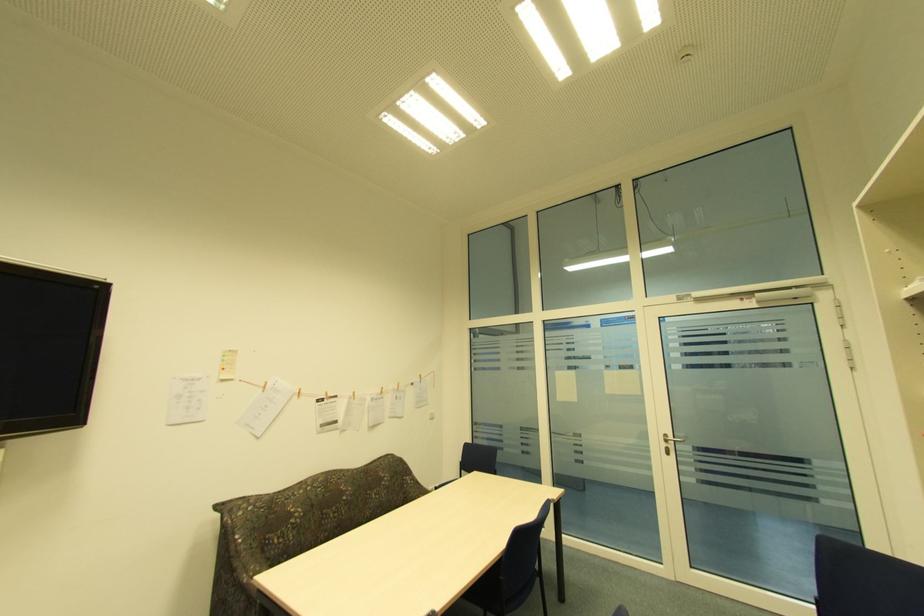
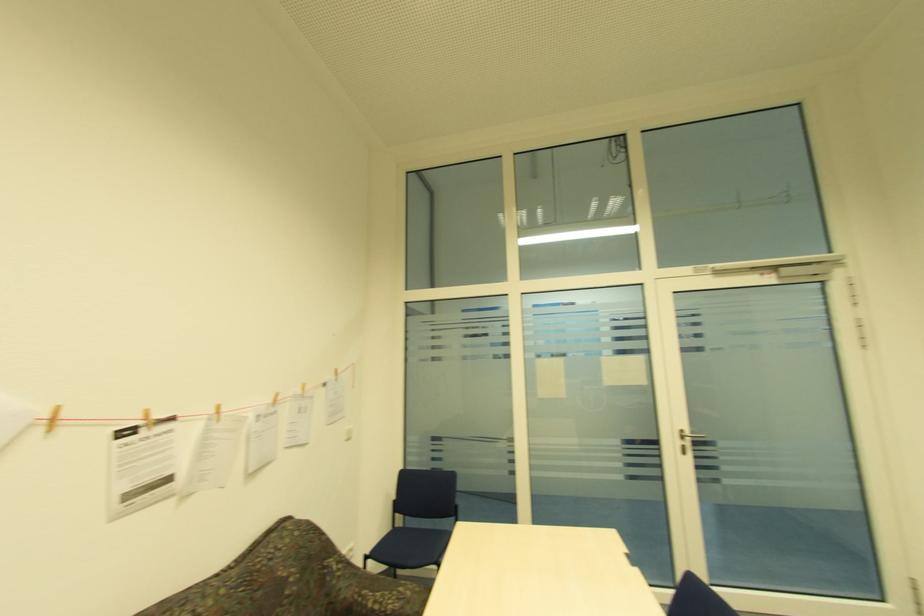
Locate, in the second image, the point that corresponds to point 300,392 in the first image.

(49, 416)